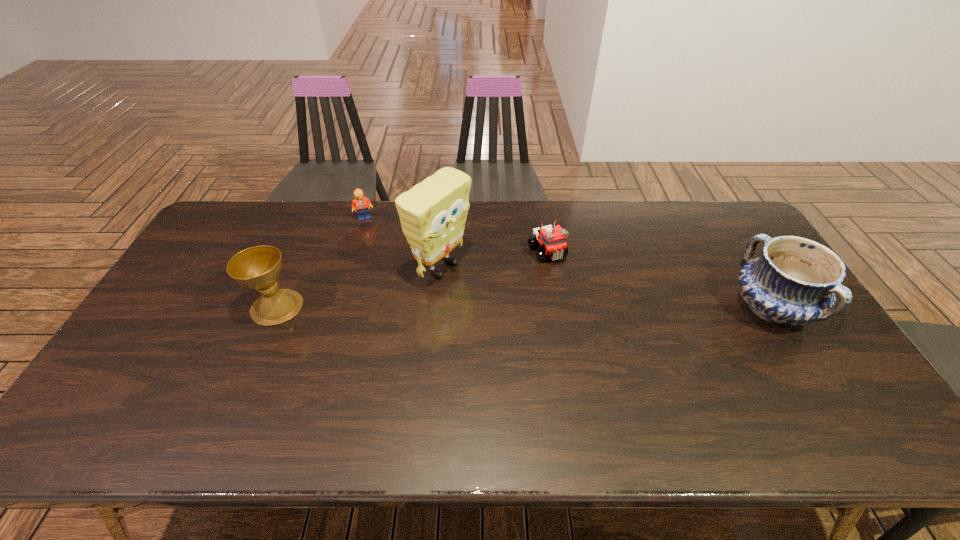
Locate an element on the screen. This screenshot has width=960, height=540. vacant space located 0.170m on the face of the tallest object is located at coordinates (512, 308).

This screenshot has width=960, height=540. Find the location of `vacant space located on the face of the tallest object`. vacant space located on the face of the tallest object is located at coordinates (492, 298).

Where is `free space located 0.220m on the face of the tallest object`? This screenshot has height=540, width=960. free space located 0.220m on the face of the tallest object is located at coordinates (526, 316).

You are a GUI agent. You are given a task and a screenshot of the screen. Output one action in this format:
    pyautogui.click(x=<x>, y=<y>)
    Task: Click on the blank area located 0.110m on the front-facing side of the nearer Lego
    This screenshot has width=960, height=540.
    Given the screenshot: What is the action you would take?
    pyautogui.click(x=573, y=288)

Locate an element on the screen. free space located 0.090m on the front-facing side of the nearer Lego is located at coordinates (569, 284).

Locate an element on the screen. This screenshot has height=540, width=960. vacant area located on the front-facing side of the nearer Lego is located at coordinates (595, 320).

This screenshot has width=960, height=540. Find the location of `vacant space located 0.170m on the front-facing side of the second object from left to right`. vacant space located 0.170m on the front-facing side of the second object from left to right is located at coordinates (395, 246).

What are the coordinates of `vacant area situated 0.170m on the front-facing side of the second object from left to right` in the screenshot? It's located at (395, 246).

Where is `free space located 0.400m on the front-facing side of the second object from left to right`? This screenshot has width=960, height=540. free space located 0.400m on the front-facing side of the second object from left to right is located at coordinates 433,285.

Identify the location of object at the right edge. (794, 281).